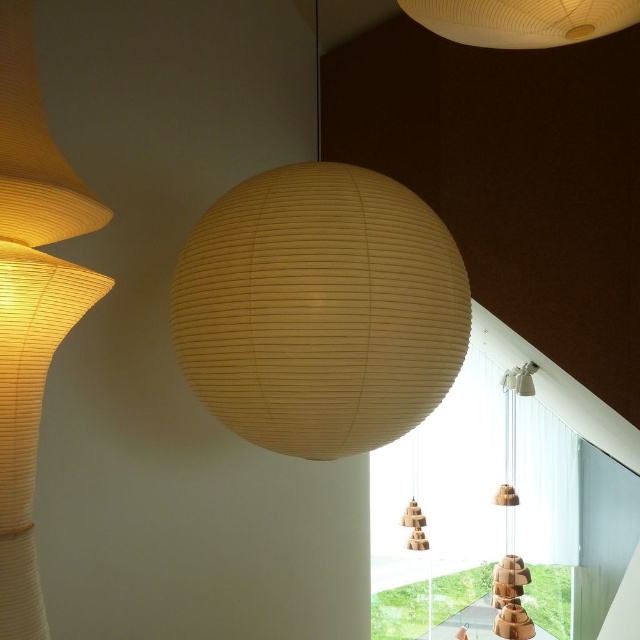
Who is more distant from viewer, (454, 26) or (500, 580)?

Point (500, 580)

Where is `matte white sphere at upper center`? matte white sphere at upper center is located at coordinates (522, 20).

Between point (518, 372) and point (417, 458), which one is positioned in front?

Point (518, 372) is in front.

Describe the element at coordinates (512, 518) in the screenshot. Image resolution: width=640 pixels, height=640 pixels. I see `wooden at right` at that location.

I want to click on wooden at right, so click(x=512, y=518).

Does matte beige paper lampshade at left have a greater height compared to wooden tower at center?

Indeed, matte beige paper lampshade at left has a greater height compared to wooden tower at center.

Is matte beige paper lampshade at left to the left of wooden tower at center from the viewer's perspective?

Indeed, matte beige paper lampshade at left is positioned on the left side of wooden tower at center.

Does point (40, 259) come behind point (412, 451)?

No, it is not.

Identify the location of matte beige paper lampshade at left. (29, 301).